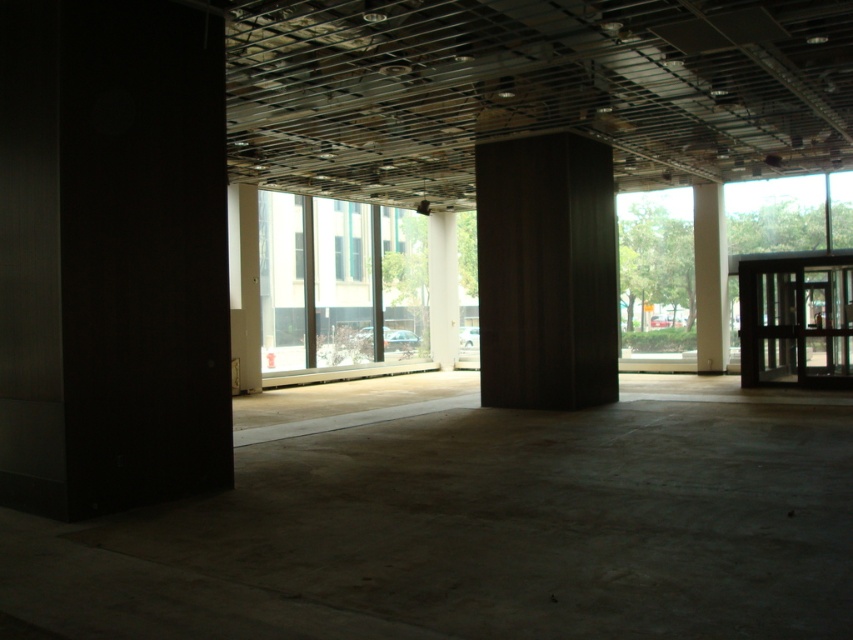
Question: Which object is farther from the camera taking this photo?

Choices:
 (A) white smooth pillar at right
 (B) transparent glass door at right

Answer: (A)

Question: Can you confirm if dark wood pillar at center is positioned to the right of white smooth pillar at center?

Choices:
 (A) yes
 (B) no

Answer: (A)

Question: Based on their relative distances, which object is nearer to the dark wood pillar at center?

Choices:
 (A) transparent glass door at right
 (B) white smooth pillar at center

Answer: (A)

Question: Is dark wood pillar at center bigger than white smooth pillar at center?

Choices:
 (A) yes
 (B) no

Answer: (A)

Question: Which object appears farthest from the camera in this image?

Choices:
 (A) transparent glass door at right
 (B) white smooth pillar at center

Answer: (B)

Question: Is dark wood pillar at center smaller than transparent glass door at right?

Choices:
 (A) no
 (B) yes

Answer: (A)